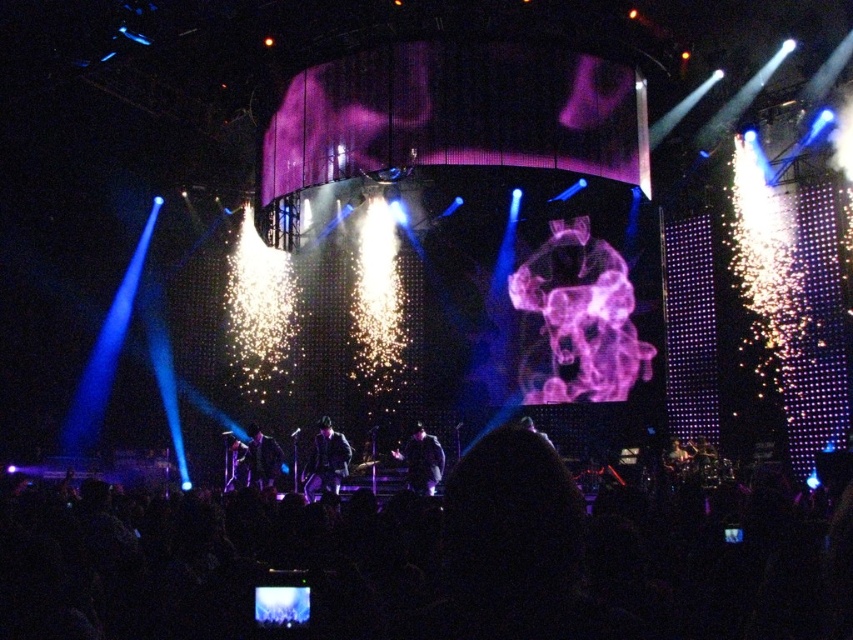
Question: Among these objects, which one is farthest from the camera?

Choices:
 (A) black fabric crowd at lower center
 (B) dark suit at center

Answer: (B)

Question: Which point appears farthest from the camera in this image?

Choices:
 (A) (270, 456)
 (B) (321, 417)
 (C) (422, 484)
 (D) (173, 502)

Answer: (B)

Question: Which of the following is the closest to the observer?

Choices:
 (A) (425, 481)
 (B) (257, 460)
 (C) (822, 592)

Answer: (C)

Question: Where is black fabric crowd at lower center located in relation to dark blue fabric jacket at center in the image?

Choices:
 (A) right
 (B) left

Answer: (A)

Question: Is dark blue fabric jacket at center closer to the viewer compared to dark suit at center?

Choices:
 (A) yes
 (B) no

Answer: (A)

Question: Does shiny black suit at center appear on the left side of dark suit at center?

Choices:
 (A) yes
 (B) no

Answer: (B)